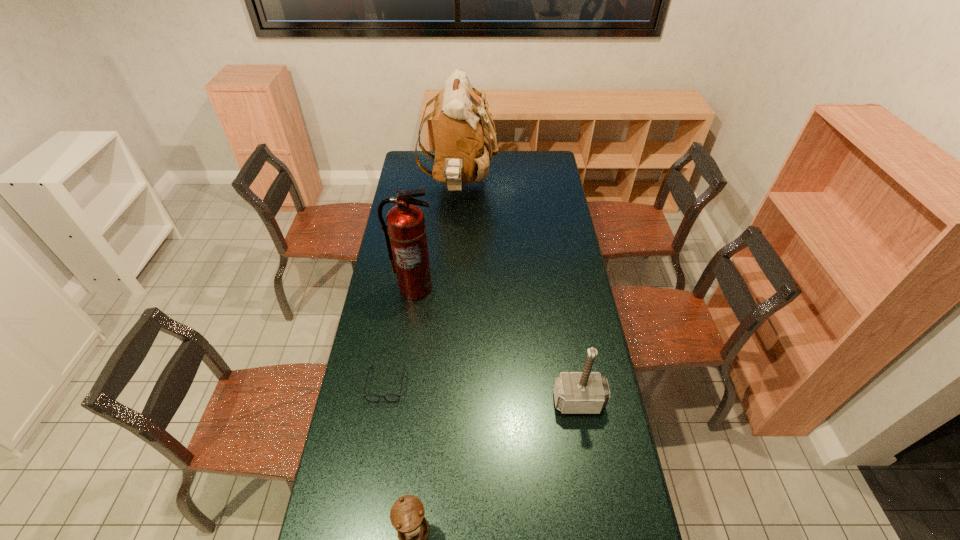
You are a GUI agent. You are given a task and a screenshot of the screen. Output one action in this format:
    pyautogui.click(x=<x>, y=<y>)
    Task: Click on the farthest object
    Image resolution: width=960 pixels, height=540 pixels.
    Given the screenshot: What is the action you would take?
    pyautogui.click(x=461, y=139)

Where is `fire extinguisher`? fire extinguisher is located at coordinates (405, 234).

Locate an element on the screen. The width and height of the screenshot is (960, 540). hammer is located at coordinates point(586,392).

The image size is (960, 540). In order to click on the rightmost object in this screenshot , I will do (x=586, y=392).

Identify the location of spectacles. This screenshot has width=960, height=540. (373, 398).

In order to click on vacant space located 0.150m on the front-facing side of the backpack in this screenshot , I will do `click(524, 185)`.

Where is `vacant space located 0.200m on the side of the fire extinguisher with the handle and hose`? The image size is (960, 540). vacant space located 0.200m on the side of the fire extinguisher with the handle and hose is located at coordinates (408, 340).

Locate an element on the screen. vacant space located for striking with the head of the hammer is located at coordinates (588, 457).

You are a GUI agent. You are given a task and a screenshot of the screen. Output one action in this format:
    pyautogui.click(x=<x>, y=<y>)
    Task: Click on the vacant space located 0.400m on the front-facing side of the shortest object
    This screenshot has height=540, width=960.
    Given the screenshot: What is the action you would take?
    [x=362, y=531]

Identify the location of object located at the far edge. This screenshot has height=540, width=960. (461, 139).